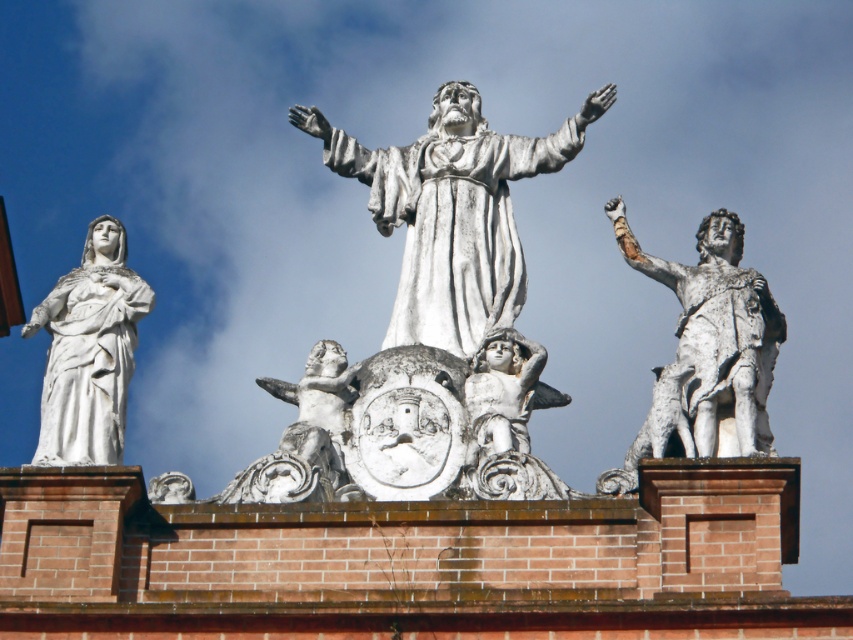
Can you confirm if silver metallic warrior at right is positioned above white marble statue at left?

Actually, silver metallic warrior at right is below white marble statue at left.

Is point (662, 266) less distant than point (109, 266)?

Yes, it is in front of point (109, 266).

Identify the location of silver metallic warrior at right. The height and width of the screenshot is (640, 853). (706, 353).

Is white marble statue at center smaller than silver metallic warrior at right?

Incorrect, white marble statue at center is not smaller in size than silver metallic warrior at right.

Is point (363, 154) positioned in front of point (759, 282)?

No.

At what (x,y) coordinates should I click in order to perform the action: click on white marble statue at center. Please return your answer as a coordinate pair (x, y). This screenshot has height=640, width=853. Looking at the image, I should click on (451, 211).

Between point (703, 355) and point (488, 337), which one is positioned behind?

Point (488, 337)

Where is `silver metallic warrior at right`? The image size is (853, 640). silver metallic warrior at right is located at coordinates (706, 353).